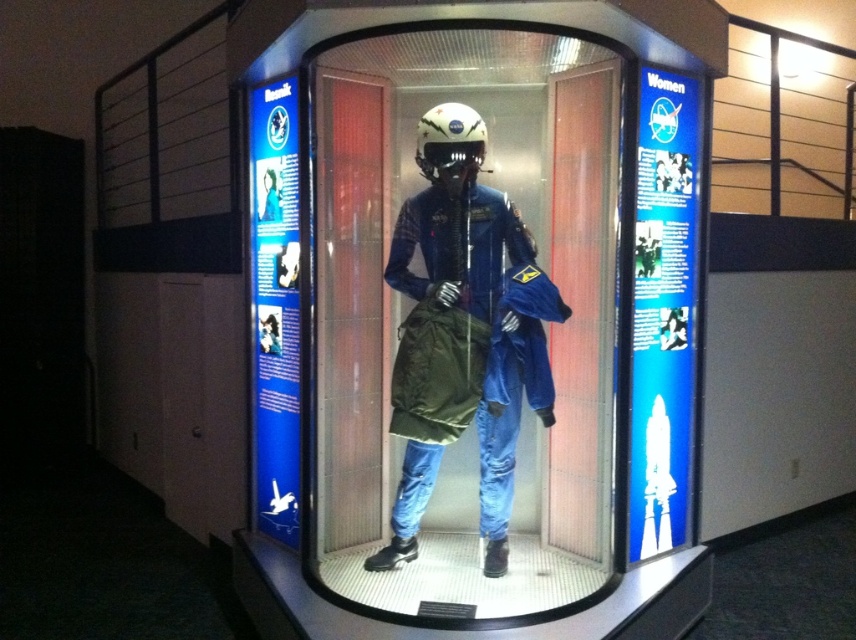
Question: Which point is farther from the camera taking this photo?

Choices:
 (A) (482, 125)
 (B) (507, 499)

Answer: (B)

Question: Does transparent plastic display case at center appear over white matte helmet at center?

Choices:
 (A) no
 (B) yes

Answer: (A)

Question: Does blue fabric spacesuit at center lie behind white matte helmet at center?

Choices:
 (A) no
 (B) yes

Answer: (A)

Question: Is transparent plastic display case at center further to camera compared to blue fabric spacesuit at center?

Choices:
 (A) no
 (B) yes

Answer: (A)

Question: Which point is closer to the camera taking this photo?

Choices:
 (A) click(x=513, y=342)
 (B) click(x=521, y=396)
 (C) click(x=441, y=112)

Answer: (A)

Question: Which of the following is the closest to the observer?

Choices:
 (A) (452, 269)
 (B) (455, 96)

Answer: (A)